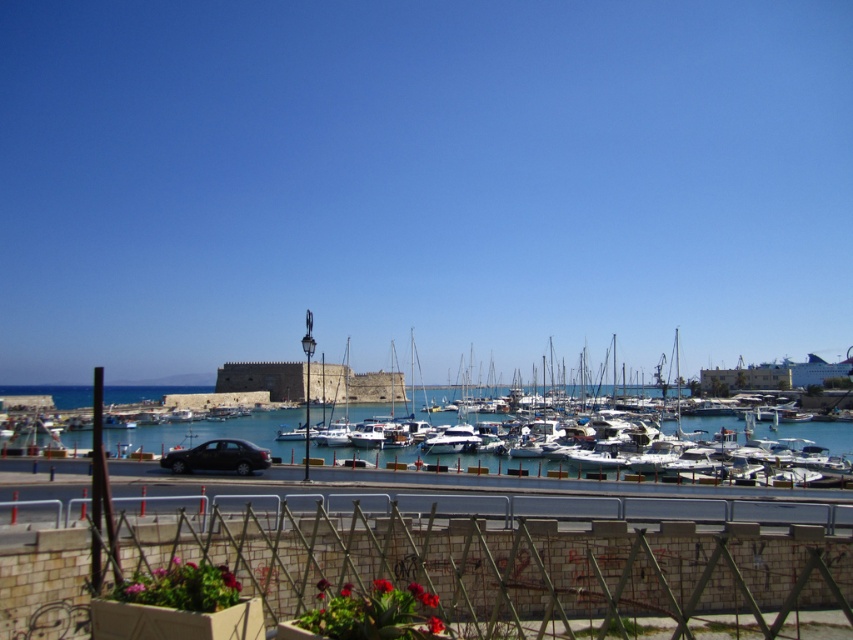
You are planning to park your vehicle in the marina parking lot, which has spaces designed for standard cars. You see the white glossy boat at center and the shiny black sedan at center. Which one is wider and might not fit in a standard parking space?

The white glossy boat at center is wider than the shiny black sedan at center, so it might not fit in a standard parking space designed for standard cars.

You are standing at the stone wall with the metal railing. You see a point marked at coordinates [212,433]. Where is this point located in the scene?

The point at [212,433] is on the blue water at center.

You are a photographer planning to capture the white glossy boat at center and the shiny black sedan at center in a single frame. Given their sizes, which object should you position closer to the camera to ensure both are visible in the frame without cropping?

The white glossy boat at center is larger in size than the shiny black sedan at center. To ensure both fit in the frame, position the shiny black sedan at center closer to the camera since it is smaller, allowing the larger boat to be slightly farther back and still visible without cropping.